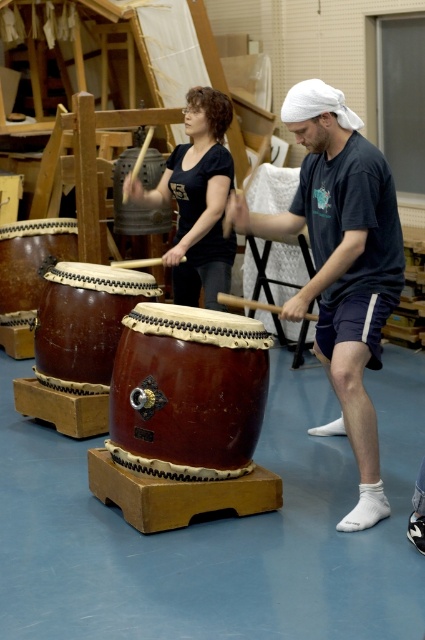
Consider the image. Which is more to the right, matte black drum at center or brown wooden drum at center?

matte black drum at center is more to the right.

Describe the element at coordinates (198, 200) in the screenshot. I see `matte black drum at center` at that location.

Who is more forward, (x=178, y=301) or (x=119, y=230)?

Point (x=178, y=301) is more forward.

Where is `matte black drum at center`? matte black drum at center is located at coordinates (198, 200).

Does matte black drum at center have a larger size compared to brown leather drum at center?

Yes, matte black drum at center is bigger than brown leather drum at center.

Where is `matte black drum at center`? Image resolution: width=425 pixels, height=640 pixels. matte black drum at center is located at coordinates (198, 200).

Is point (209, 166) positioned behind point (51, 356)?

Yes, point (209, 166) is farther from viewer.

Identify the location of matte black drum at center. This screenshot has height=640, width=425. (198, 200).

Is shiny brown drum at center behind brown leather drum at center?

No, it is not.

Can you confirm if shiny brown drum at center is shorter than brown leather drum at center?

Incorrect, shiny brown drum at center's height does not fall short of brown leather drum at center's.

Who is more distant from viewer, (229,340) or (93,308)?

The point (93,308) is behind.

Where is `shiny brown drum at center`? The width and height of the screenshot is (425, 640). shiny brown drum at center is located at coordinates (187, 392).